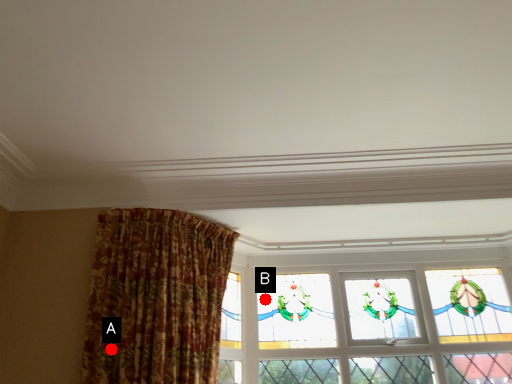
Question: Two points are circled on the image, labeled by A and B beside each circle. Which point is closer to the camera taking this photo?

Choices:
 (A) A is closer
 (B) B is closer

Answer: (A)